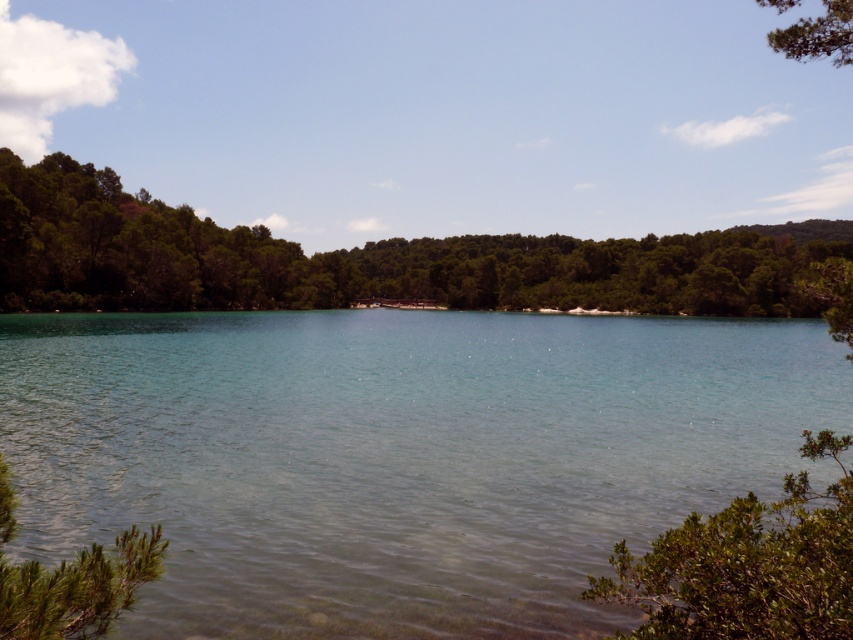
Is green leafy shrub at lower left shorter than green textured tree at upper right?

Correct, green leafy shrub at lower left is not as tall as green textured tree at upper right.

Can you confirm if green leafy shrub at lower left is positioned to the right of green textured tree at upper right?

Incorrect, green leafy shrub at lower left is not on the right side of green textured tree at upper right.

Which is in front, point (94, 598) or point (805, 52)?

Positioned in front is point (94, 598).

Where is `green leafy shrub at lower left`? The height and width of the screenshot is (640, 853). green leafy shrub at lower left is located at coordinates (71, 580).

Is point (485, 440) positioned before point (4, 632)?

That is False.

This screenshot has height=640, width=853. Find the location of `clear water at center`. clear water at center is located at coordinates (397, 456).

I want to click on clear water at center, so click(x=397, y=456).

Looking at this image, does green leafy tree at left have a greater width compared to green textured tree at upper right?

Incorrect, green leafy tree at left's width does not surpass green textured tree at upper right's.

Who is more forward, (701, 282) or (843, 13)?

Point (843, 13) is more forward.

Between point (560, 253) and point (811, 44), which one is positioned behind?

Point (560, 253)

The image size is (853, 640). What are the coordinates of `green leafy tree at left` in the screenshot? It's located at (361, 260).